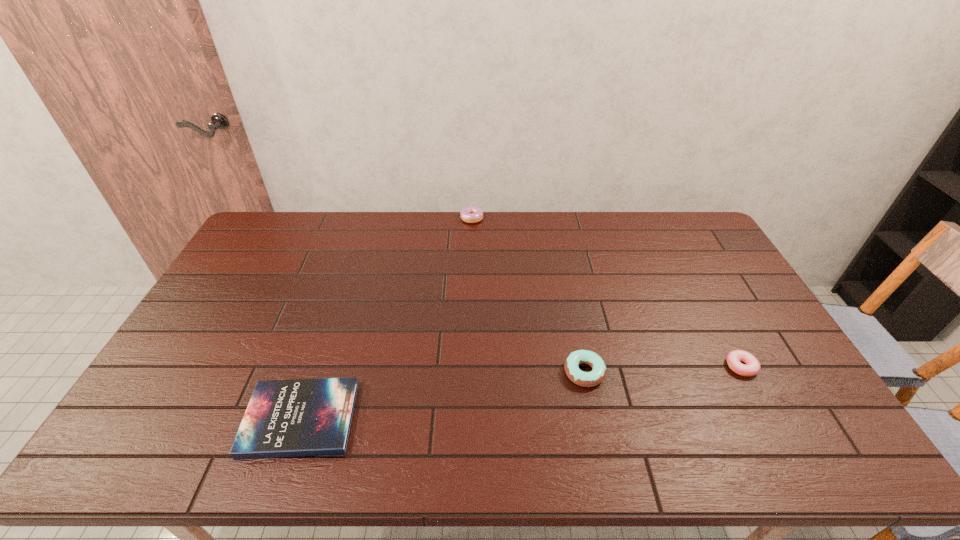
The width and height of the screenshot is (960, 540). In order to click on doughnut that stands as the second closest to the farthest doughnut in this screenshot , I will do `click(752, 367)`.

Find the location of a particular element. This screenshot has height=540, width=960. vacant space that satisfies the following two spatial constraints: 1. on the back side of the third object from left to right; 2. on the left side of the leftmost object is located at coordinates (316, 372).

I want to click on vacant space that satisfies the following two spatial constraints: 1. on the front side of the shortest doughnut; 2. on the left side of the farthest doughnut, so click(x=468, y=366).

At what (x,y) coordinates should I click in order to perform the action: click on free location that satisfies the following two spatial constraints: 1. on the front side of the farthest object; 2. on the right side of the rightmost object. Please return your answer as a coordinate pair (x, y). Looking at the image, I should click on (468, 366).